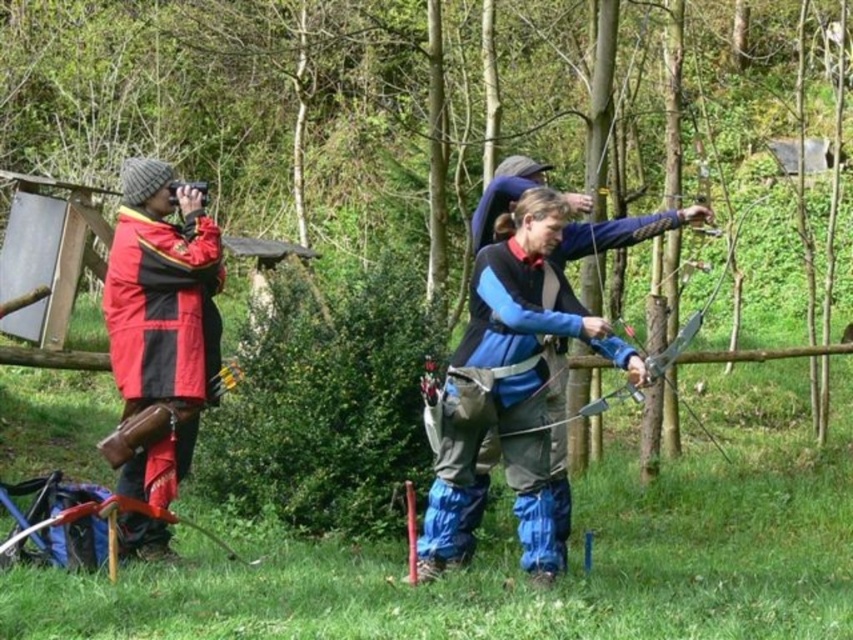
Which is more to the right, blue matte archer at center or red matte jacket at left?

blue matte archer at center

Does point (442, 534) come behind point (218, 330)?

No, (442, 534) is closer to viewer.

Find the location of a particular element. blue matte archer at center is located at coordinates (515, 384).

At what (x,y) coordinates should I click in order to perform the action: click on blue matte archer at center. Please return your answer as a coordinate pair (x, y). Looking at the image, I should click on (515, 384).